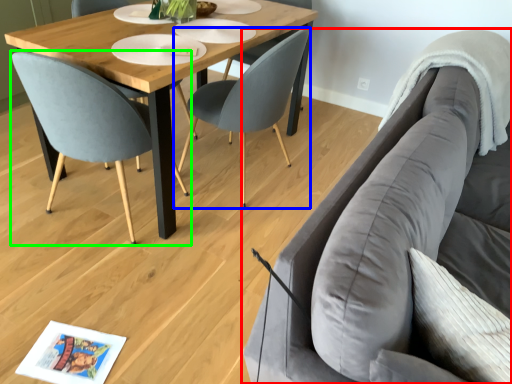
Question: Considering the real-world distances, which object is closest to studio couch (highlighted by a red box)? chair (highlighted by a blue box) or chair (highlighted by a green box).

Choices:
 (A) chair
 (B) chair

Answer: (A)